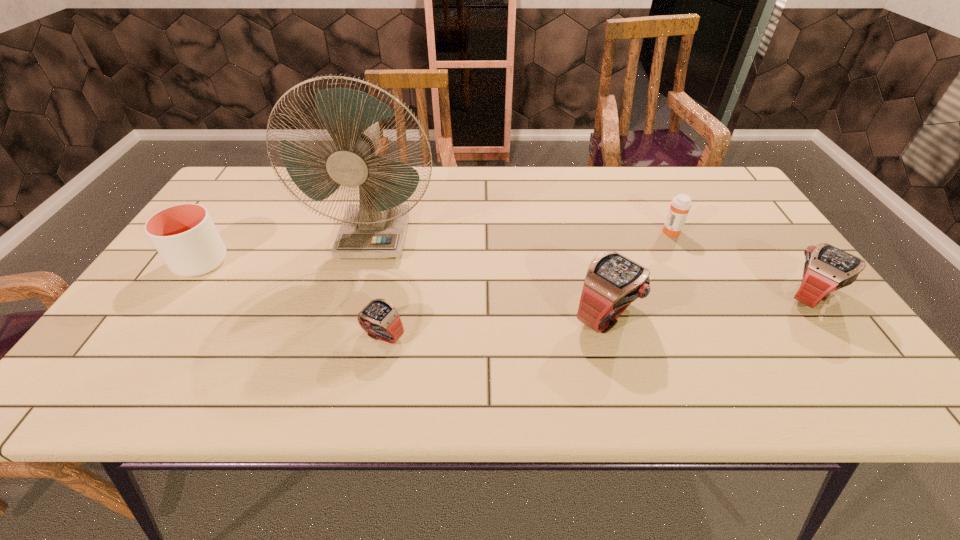
This screenshot has width=960, height=540. What are the coordinates of `the shortest object` in the screenshot? It's located at (379, 318).

Image resolution: width=960 pixels, height=540 pixels. Identify the location of the shortest watch. (379, 318).

The height and width of the screenshot is (540, 960). I want to click on the second watch from left to right, so click(x=612, y=282).

The height and width of the screenshot is (540, 960). I want to click on the rightmost object, so [x=827, y=268].

Identify the location of the rightmost watch. The image size is (960, 540). (827, 268).

In order to click on the tallest object in this screenshot , I will do `click(376, 227)`.

The image size is (960, 540). What are the coordinates of `the second object from right to left` in the screenshot? It's located at (681, 204).

You are a GUI agent. You are given a task and a screenshot of the screen. Output one action in this format:
    pyautogui.click(x=<x>, y=<y>)
    Task: Click on the cup
    
    Given the screenshot: What is the action you would take?
    pyautogui.click(x=184, y=235)

Where is `vacant position located on the back of the leftmost watch`? The width and height of the screenshot is (960, 540). vacant position located on the back of the leftmost watch is located at coordinates (389, 306).

Identify the location of blank space located 0.200m on the back of the fourth object from left to right. (585, 238).